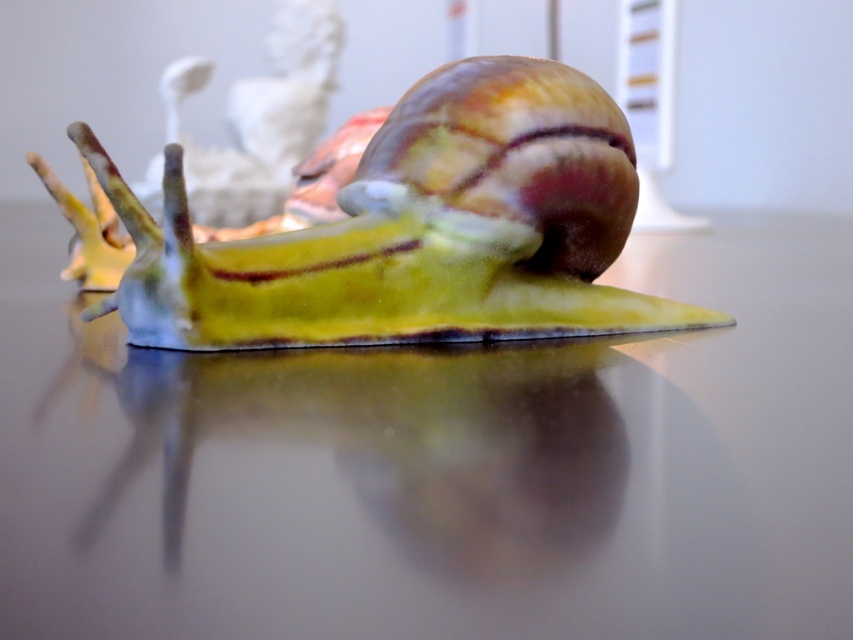
You are placing a small decorative snail sculpture on a table. The snail sculpture is at position point (439, 465). Where exactly on the table should you place it?

The point (439, 465) marks the glossy glass table at center, so you should place the snail sculpture at the glossy glass table at center.

You are arranging a display and want to place a small vase between the glossy glass table at center and the shiny green snail at center. Where should you place the vase so it is between them?

The glossy glass table at center is below the shiny green snail at center, so you should place the vase on the glossy glass table at center between it and the shiny green snail at center.

You are placing a sculpture of a snail on the glossy glass table at center. If you want to ensure the snail is centered precisely on the table, what coordinates should you aim for?

The glossy glass table at center is located at point (x=439, y=465), so you should place the snail at those coordinates to center it precisely on the table.